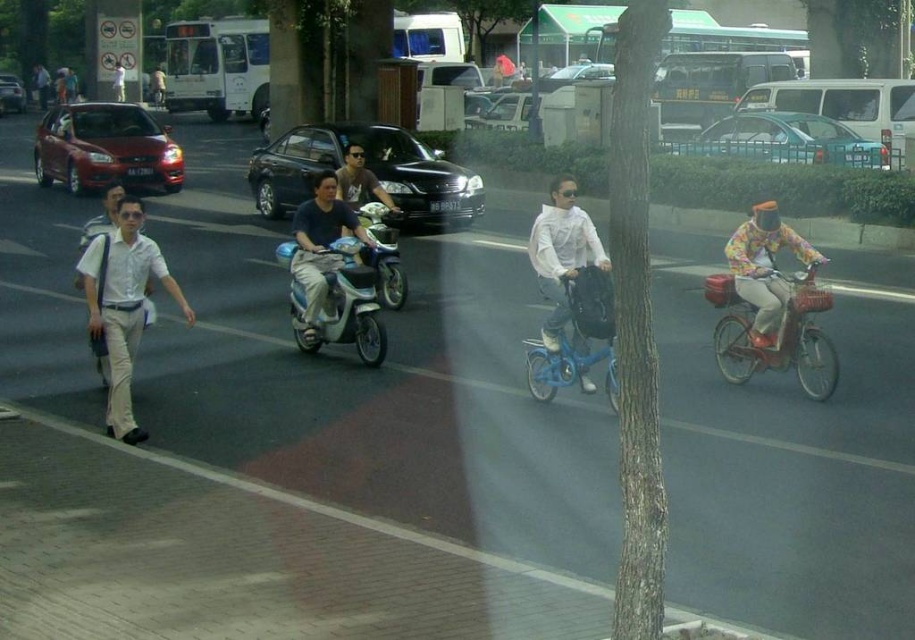
Question: Does matte black sedan at center lie in front of matte red car at left?

Choices:
 (A) yes
 (B) no

Answer: (A)

Question: Is white cotton shirt at left further to camera compared to light brown leather jacket at center?

Choices:
 (A) no
 (B) yes

Answer: (A)

Question: Which of the following is the closest to the observer?

Choices:
 (A) teal matte car at upper right
 (B) blue matte bicycle at center

Answer: (B)

Question: Is metallic red bicycle at right below blue matte bicycle at center?

Choices:
 (A) yes
 (B) no

Answer: (B)

Question: Which point is farther to the camera?

Choices:
 (A) metallic silver scooter at center
 (B) matte black scooter at center

Answer: (B)

Question: Which point is closer to the camera taking this photo?

Choices:
 (A) (371, 336)
 (B) (412, 148)
 (C) (833, 157)
 (D) (0, 77)

Answer: (A)